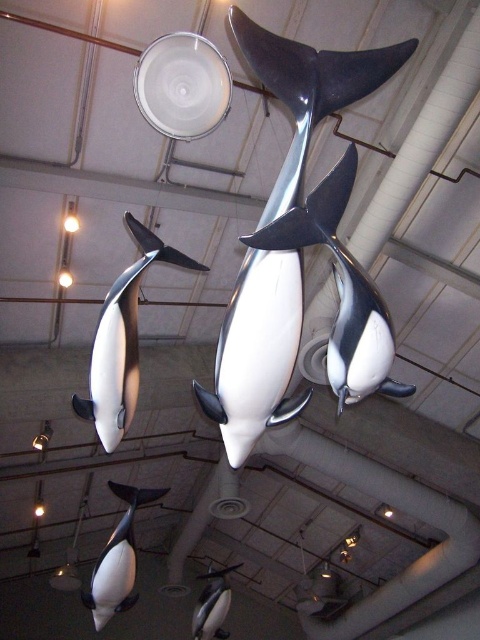
Is black and white dolphin at center below black and white dolphin at left?

No, black and white dolphin at center is not below black and white dolphin at left.

Is point (331, 228) positioned before point (108, 445)?

Yes, it is in front of point (108, 445).

Describe the element at coordinates (342, 289) in the screenshot. I see `black and white dolphin at center` at that location.

Where is `black and white dolphin at center`? This screenshot has width=480, height=640. black and white dolphin at center is located at coordinates (342, 289).

Is shiny metallic whale at center taller than black and white dolphin at left?

Yes, shiny metallic whale at center is taller than black and white dolphin at left.

Who is more distant from viewer, (271, 362) or (98, 342)?

The point (98, 342) is more distant.

Identify the location of shiny metallic whale at center. (255, 349).

Does shiny metallic whale at center have a lesser width compared to black and white dolphin at center?

Incorrect, shiny metallic whale at center's width is not less than black and white dolphin at center's.

What are the coordinates of `shiny metallic whale at center` in the screenshot? It's located at (255, 349).

At what (x,y) coordinates should I click in order to perform the action: click on shiny metallic whale at center. Please return your answer as a coordinate pair (x, y). This screenshot has height=640, width=480. Looking at the image, I should click on (255, 349).